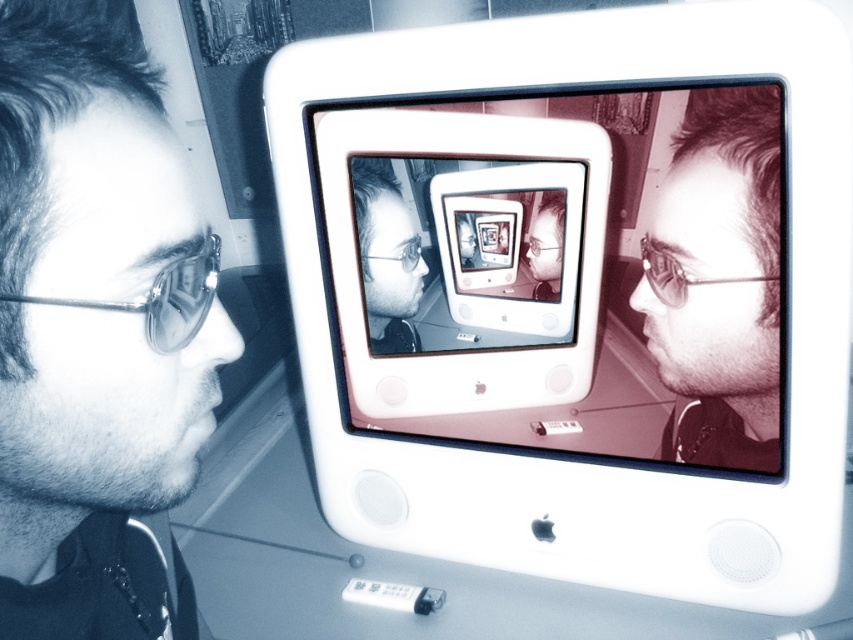
Is smooth metal face at left wider than silver metallic ipod at center?

Correct, the width of smooth metal face at left exceeds that of silver metallic ipod at center.

From the picture: Does smooth metal face at left have a lesser height compared to silver metallic ipod at center?

No.

Between point (56, 83) and point (381, 586), which one is positioned behind?

The point (381, 586) is behind.

Locate an element on the screen. This screenshot has width=853, height=640. smooth metal face at left is located at coordinates (96, 332).

Is matte white monitor at center below silver metallic ipod at center?

No, matte white monitor at center is not below silver metallic ipod at center.

Identify the location of matte white monitor at center. (563, 272).

Identify the location of matte white monitor at center. (563, 272).

Is matte white monitor at center behind smooth metal face at left?

Yes, it is behind smooth metal face at left.

Where is `matte white monitor at center`? matte white monitor at center is located at coordinates (563, 272).

Locate an element on the screen. The image size is (853, 640). matte white monitor at center is located at coordinates [x=563, y=272].